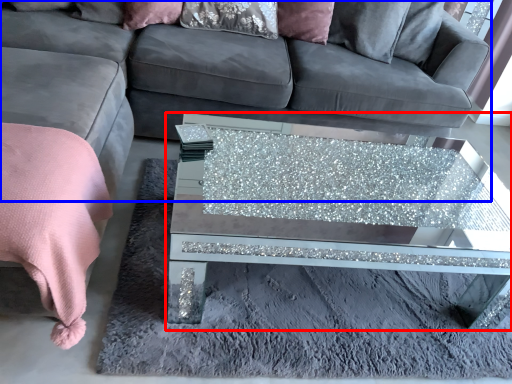
Question: Which object is further to the camera taking this photo, coffee table (highlighted by a red box) or studio couch (highlighted by a blue box)?

Choices:
 (A) coffee table
 (B) studio couch

Answer: (B)